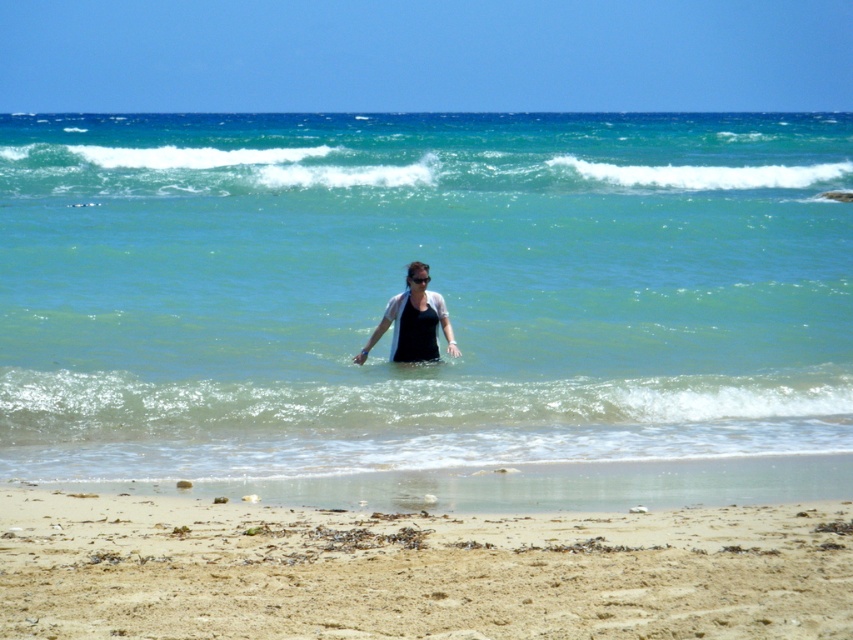
Question: Which object is farther from the camera taking this photo?

Choices:
 (A) black matte wetsuit at center
 (B) matte black top at center
 (C) fine-grained sand at lower center
 (D) clear blue water at center

Answer: (A)

Question: In this image, where is fine-grained sand at lower center located relative to green translucent water at upper center?

Choices:
 (A) below
 (B) above

Answer: (A)

Question: Which point is closer to the camera?

Choices:
 (A) (726, 173)
 (B) (396, 346)

Answer: (B)

Question: Which object is positioned farthest from the matte black top at center?

Choices:
 (A) black matte wetsuit at center
 (B) clear blue water at center
 (C) fine-grained sand at lower center

Answer: (B)

Question: Can you confirm if fine-grained sand at lower center is smaller than green translucent water at upper center?

Choices:
 (A) no
 (B) yes

Answer: (B)

Question: Does clear blue water at center come behind fine-grained sand at lower center?

Choices:
 (A) no
 (B) yes

Answer: (B)